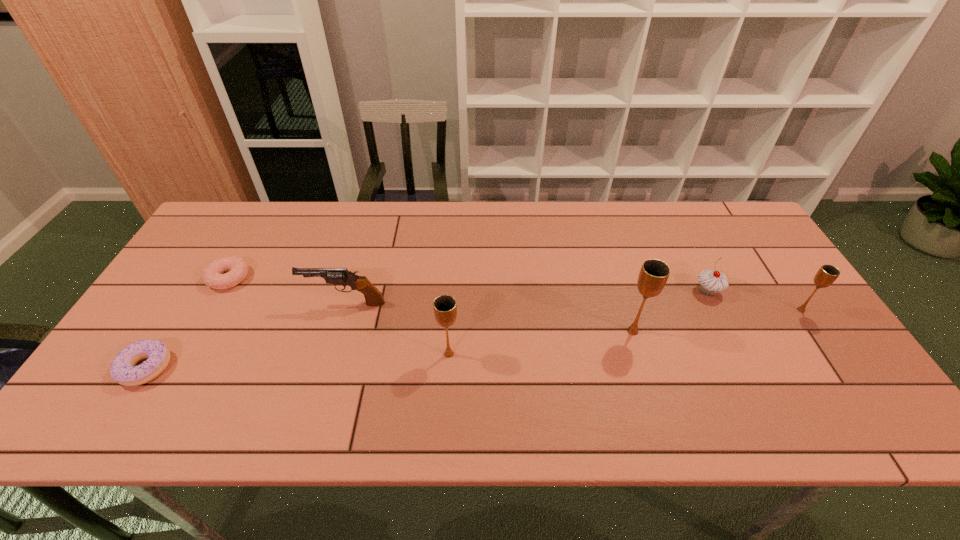
This screenshot has width=960, height=540. Identify the location of doughnut situated at the near edge. (122, 369).

Identify the location of object located in the right edge section of the desktop. (827, 274).

Locate an element on the screen. This screenshot has height=540, width=960. object situated at the near left corner is located at coordinates (122, 369).

This screenshot has width=960, height=540. I want to click on vacant position at the far edge of the desktop, so click(x=666, y=209).

The width and height of the screenshot is (960, 540). Find the location of `free region at the near edge of the desktop`. free region at the near edge of the desktop is located at coordinates (456, 367).

In the image, there is a desktop. Where is `blank space at the left edge`? The width and height of the screenshot is (960, 540). blank space at the left edge is located at coordinates (225, 289).

Identify the location of vacant area at the right edge. (782, 322).

In the image, there is a desktop. Identify the location of vacant area at the far left corner. The height and width of the screenshot is (540, 960). (230, 210).

You are a GUI agent. You are given a task and a screenshot of the screen. Output one action in this format:
    pyautogui.click(x=<x>, y=<y>)
    Task: Click on the vacant space at the near left corner
    The height and width of the screenshot is (540, 960).
    Given the screenshot: What is the action you would take?
    pyautogui.click(x=152, y=383)

Where is `free space between the sixth object from left to right and the rightmost chalice`? This screenshot has height=540, width=960. free space between the sixth object from left to right and the rightmost chalice is located at coordinates (755, 300).